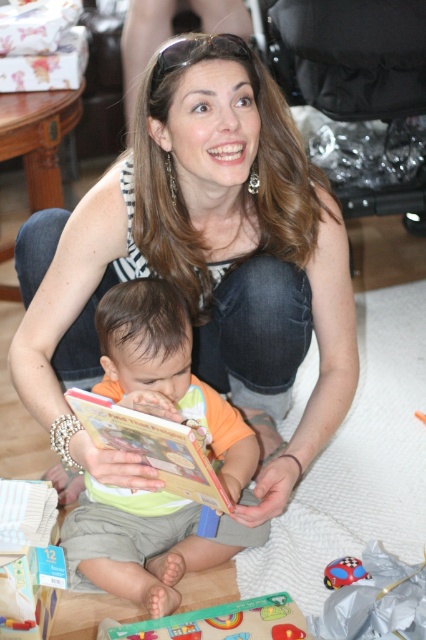
Question: Which object appears farthest from the camera in this image?

Choices:
 (A) green matte puzzle piece at lower center
 (B) plastic red car at center

Answer: (B)

Question: Does matte black tank top at upper center appear under hardcover book at center?

Choices:
 (A) no
 (B) yes

Answer: (A)

Question: Can you confirm if green matte puzzle piece at lower center is wider than plastic red car at center?

Choices:
 (A) no
 (B) yes

Answer: (B)

Question: Does green cotton bib at center appear over hardcover book at center?

Choices:
 (A) yes
 (B) no

Answer: (B)

Question: Which point is farther from the camera taking this photo?

Choices:
 (A) (189, 429)
 (B) (203, 618)
 (C) (232, 419)

Answer: (C)

Question: Considering the real-world distances, which object is farthest from the green matte puzzle piece at lower center?

Choices:
 (A) hardcover book at center
 (B) green cotton bib at center
 (C) plastic red car at center
 (D) matte black tank top at upper center

Answer: (D)